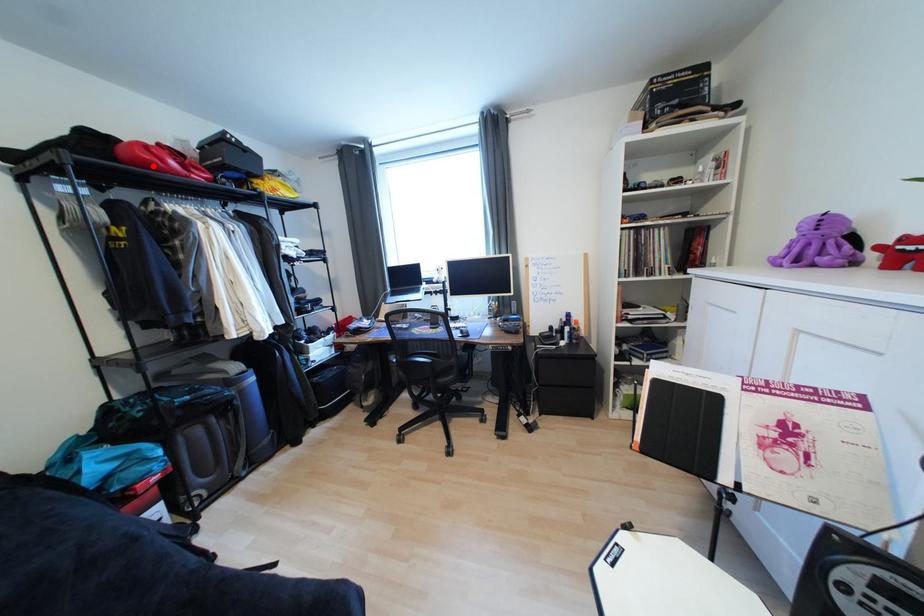
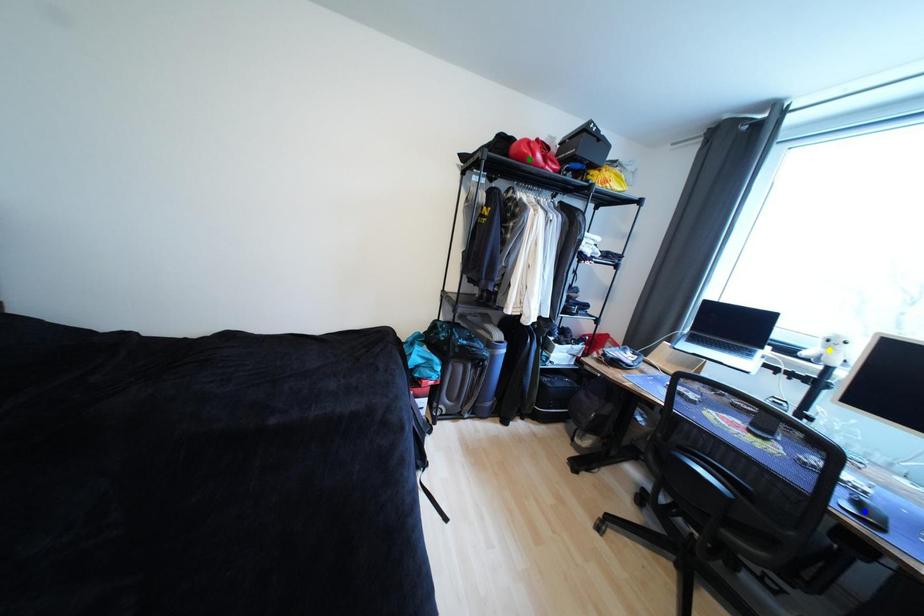
Question: I am providing you with two images of the same scene from different viewpoints. A red point is marked on the first image. You are given multiple points on the second image. In image 2, which mark is for the same physical point as the one in image 1?

Choices:
 (A) green point
 (B) yellow point
 (C) blue point

Answer: (A)